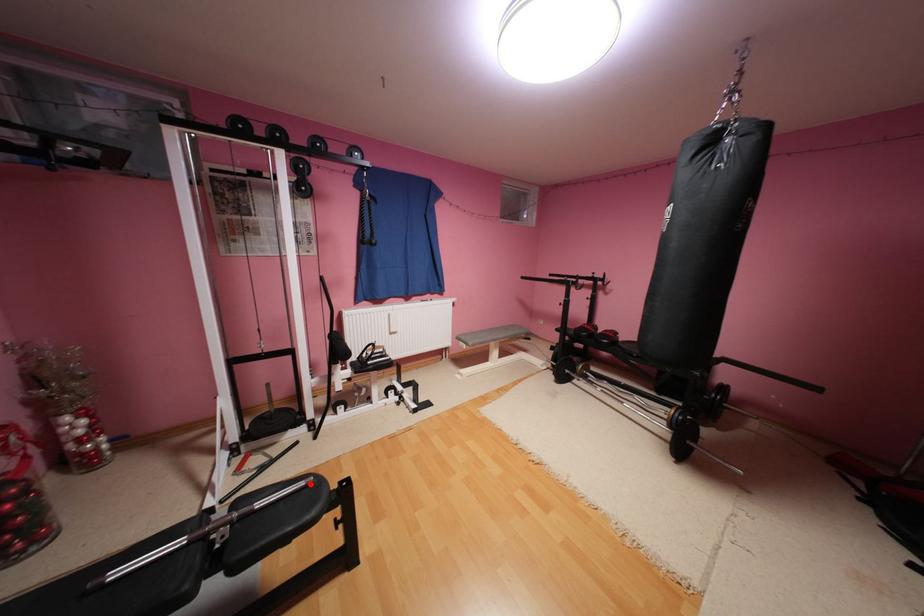
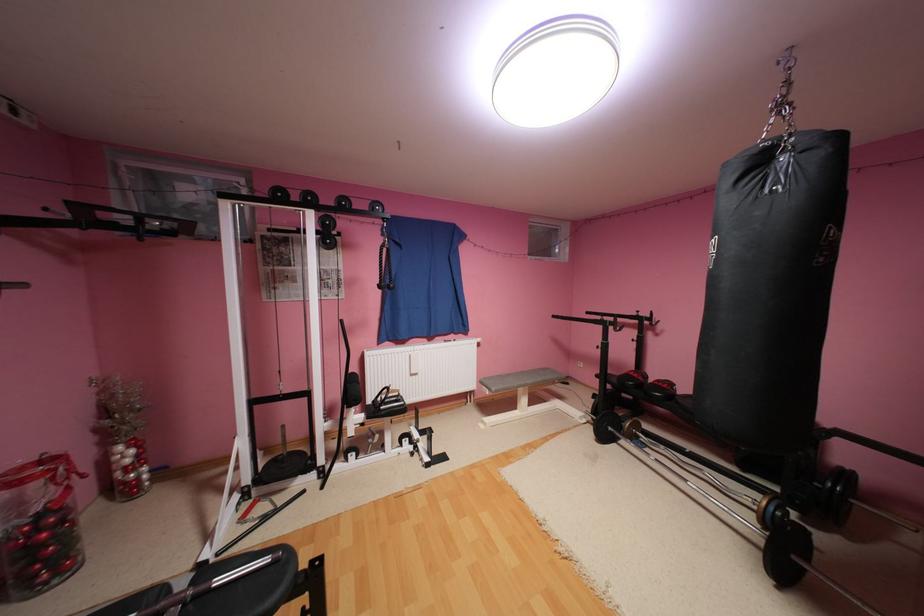
Question: I am providing you with two images of the same scene from different viewpoints. In image1, a red point is highlighted. Considering the same 3D point in image2, which of the following is correct?

Choices:
 (A) It is closer
 (B) It is farther

Answer: (B)